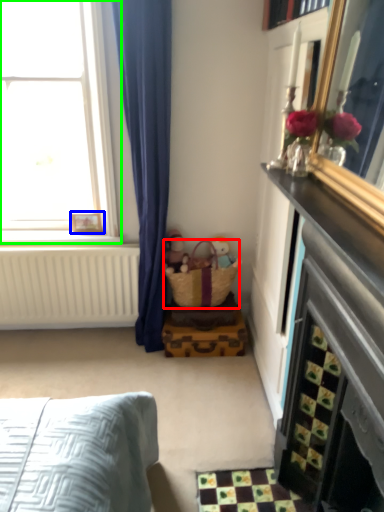
Question: Which object is positioned closest to basket (highlighted by a red box)? Select from picture frame (highlighted by a blue box) and window (highlighted by a green box).

Choices:
 (A) picture frame
 (B) window

Answer: (A)